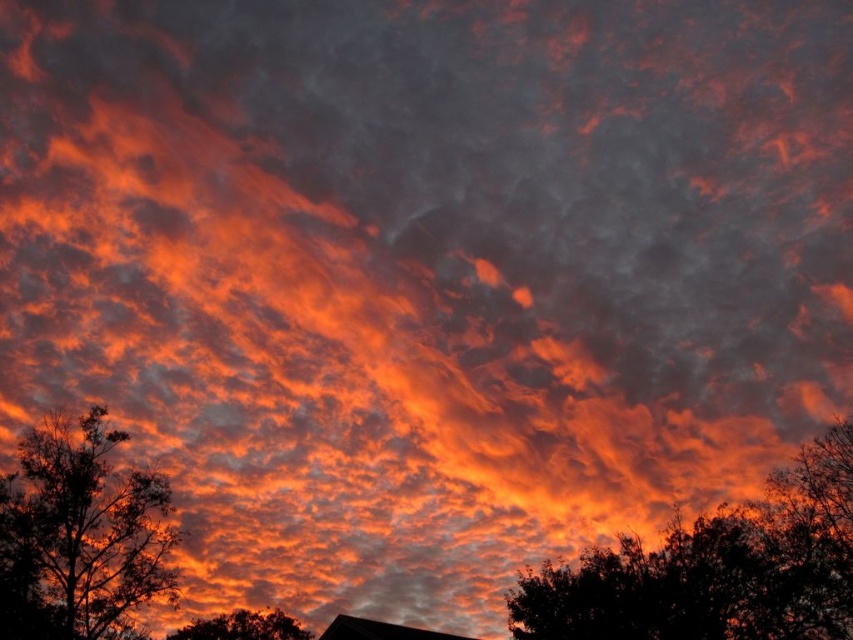
Question: Considering the relative positions of silhouette leafy tree at lower right and dark green leafy tree at lower center in the image provided, where is silhouette leafy tree at lower right located with respect to dark green leafy tree at lower center?

Choices:
 (A) left
 (B) right

Answer: (B)

Question: Is silhouette leafy tree at lower right thinner than dark green leafy tree at lower center?

Choices:
 (A) no
 (B) yes

Answer: (A)

Question: Which object is farther from the camera taking this photo?

Choices:
 (A) dark green leafy tree at left
 (B) dark green leafy tree at lower center
 (C) silhouette leafy tree at lower right

Answer: (B)

Question: Which of these objects is positioned farthest from the dark green leafy tree at left?

Choices:
 (A) silhouette leafy tree at lower right
 (B) dark green leafy tree at lower center

Answer: (A)

Question: Can you confirm if silhouette leafy tree at lower right is positioned to the left of dark green leafy tree at lower center?

Choices:
 (A) no
 (B) yes

Answer: (A)

Question: Estimate the real-world distances between objects in this image. Which object is closer to the dark green leafy tree at left?

Choices:
 (A) dark green leafy tree at lower center
 (B) silhouette leafy tree at lower right

Answer: (A)